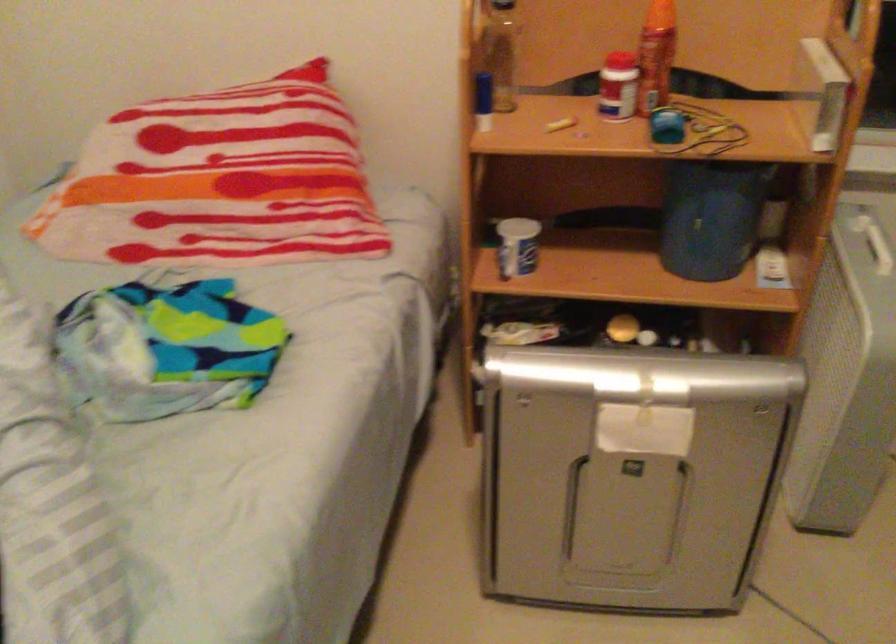
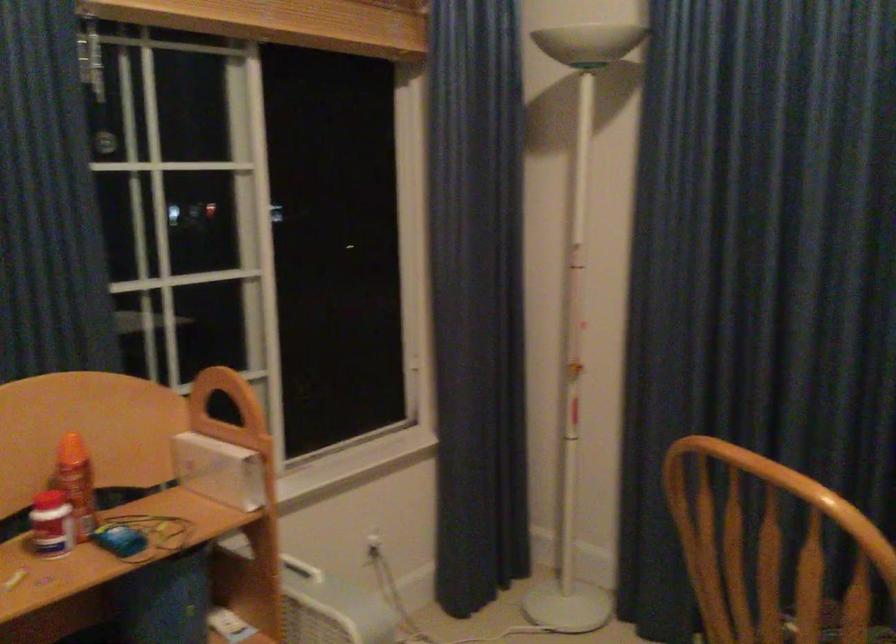
Question: How did the camera likely rotate?

Choices:
 (A) Left
 (B) Right
 (C) Up
 (D) Down

Answer: (B)